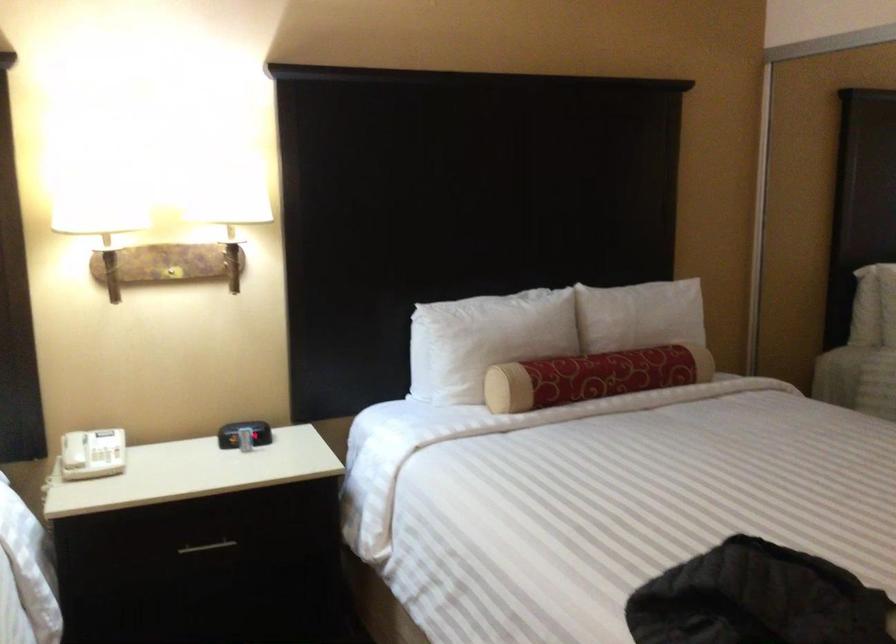
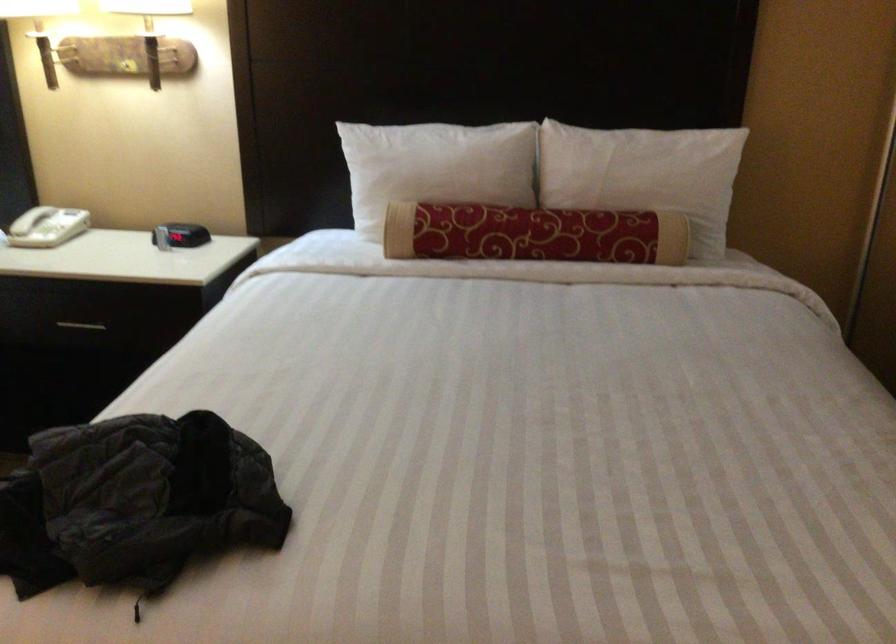
The point at [83,450] is marked in the first image. Where is the corresponding point in the second image?

(30, 220)